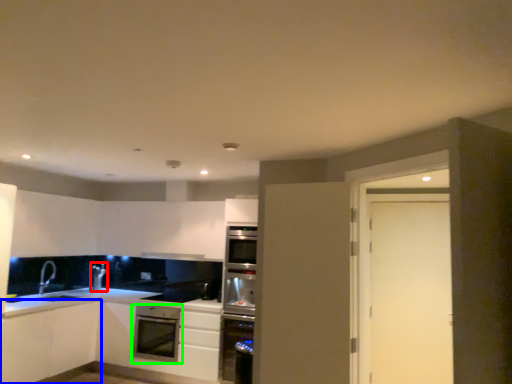
Question: Which object is positioned closest to appliance (highlighted by a red box)? Select from cabinetry (highlighted by a blue box) and kitchen appliance (highlighted by a green box).

Choices:
 (A) cabinetry
 (B) kitchen appliance

Answer: (A)